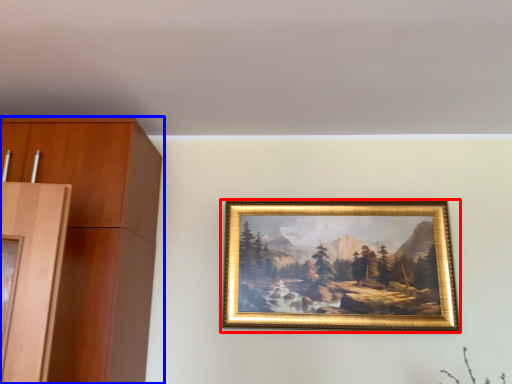
Question: Among these objects, which one is farthest to the camera, picture frame (highlighted by a red box) or cabinetry (highlighted by a blue box)?

Choices:
 (A) picture frame
 (B) cabinetry

Answer: (A)